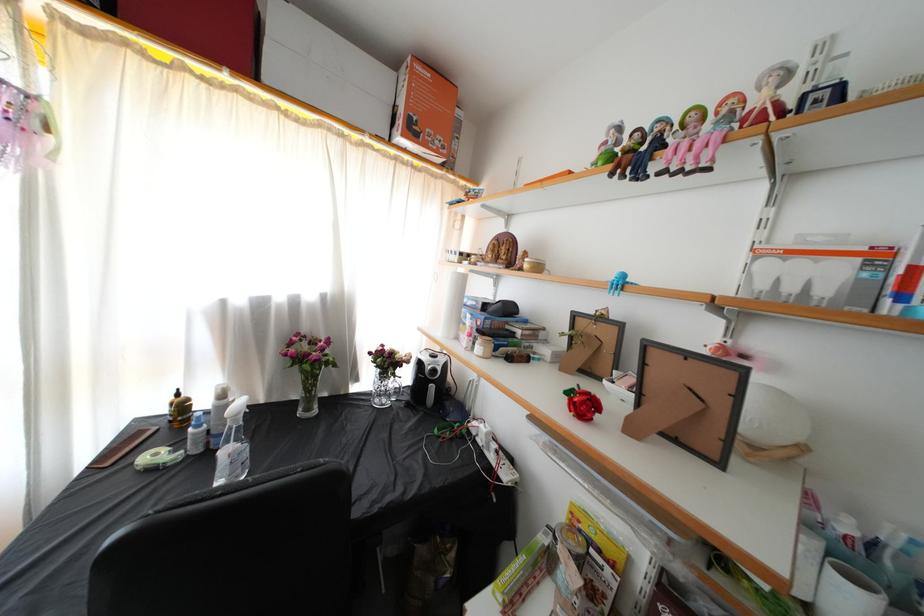
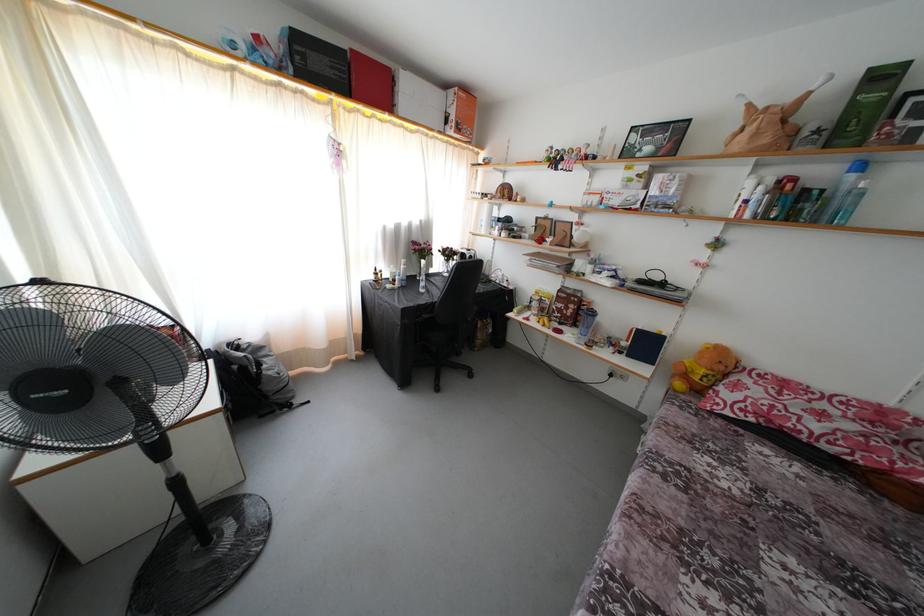
Where in the second image is the point corresponding to point 418,137 from the first image?

(463, 134)